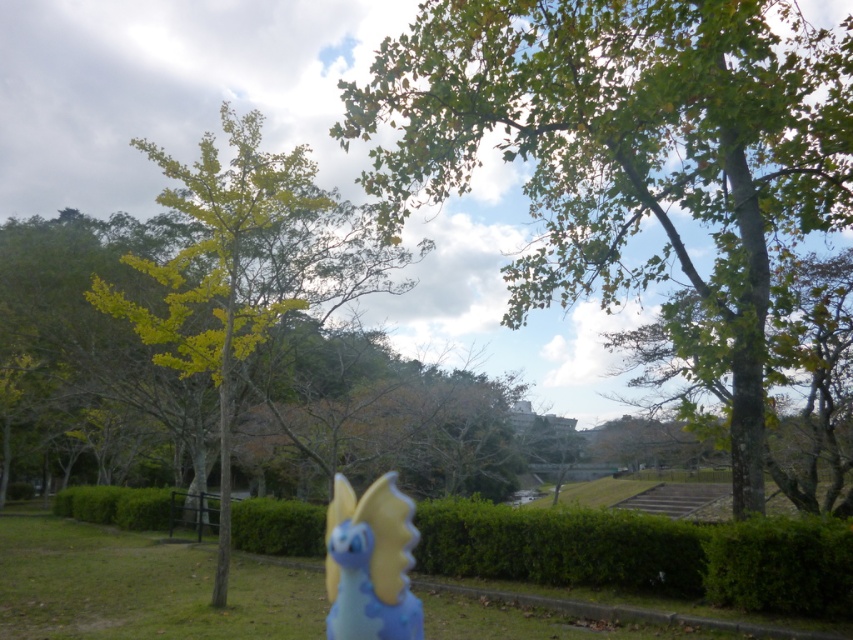
Is green hedge at lower center above yellow-green leaves at center?

Actually, green hedge at lower center is below yellow-green leaves at center.

Can you confirm if green hedge at lower center is wider than yellow-green leaves at center?

Correct, the width of green hedge at lower center exceeds that of yellow-green leaves at center.

Is point (735, 570) farther from viewer compared to point (247, 141)?

No, it is not.

Where is `green hedge at lower center`? The width and height of the screenshot is (853, 640). green hedge at lower center is located at coordinates (645, 554).

Between point (728, 16) and point (209, 358), which one is positioned in front?

Point (728, 16) is more forward.

Between point (529, 288) and point (207, 282), which one is positioned behind?

The point (529, 288) is more distant.

Which is in front, point (413, 44) or point (227, 211)?

Point (413, 44) is more forward.

Locate an element on the screen. This screenshot has height=640, width=853. green leafy tree at upper center is located at coordinates (630, 150).

Between yellow-green leaves at center and blue rubber dragonfly at center, which one is positioned higher?

yellow-green leaves at center is above.

Between yellow-green leaves at center and blue rubber dragonfly at center, which one has more height?

yellow-green leaves at center is taller.

Is point (155, 326) closer to viewer compared to point (405, 532)?

No, it is not.

Find the location of a particular element. yellow-green leaves at center is located at coordinates (218, 272).